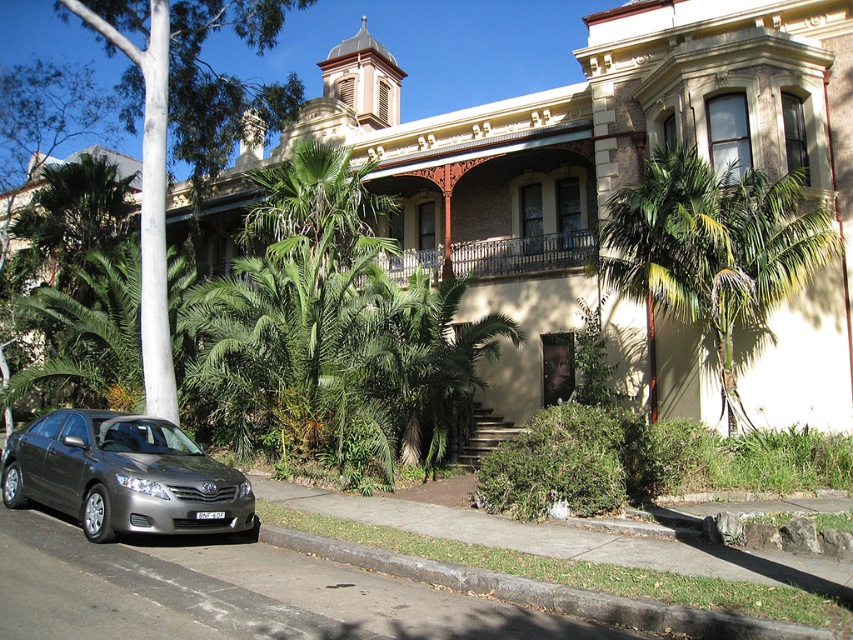
Which of these two, green leafy palm tree at center or gray concrete curb at lower center, stands shorter?

Standing shorter between the two is gray concrete curb at lower center.

Is green leafy palm tree at center below gray concrete curb at lower center?

A: No.

At what (x,y) coordinates should I click in order to perform the action: click on green leafy palm tree at center. Please return your answer as a coordinate pair (x, y). The image size is (853, 640). Looking at the image, I should click on (712, 257).

From the picture: Who is more forward, (202, 531) or (746, 628)?

Point (746, 628) is more forward.

Is satin silver sedan at lower left to the right of gray concrete curb at lower center from the viewer's perspective?

No, satin silver sedan at lower left is not to the right of gray concrete curb at lower center.

You are a GUI agent. You are given a task and a screenshot of the screen. Output one action in this format:
    pyautogui.click(x=<x>, y=<y>)
    Task: Click on the satin silver sedan at lower left
    Image resolution: width=853 pixels, height=640 pixels.
    Given the screenshot: What is the action you would take?
    pyautogui.click(x=125, y=476)

Locate an element on the screen. The image size is (853, 640). satin silver sedan at lower left is located at coordinates (125, 476).

Does green leafy tree at center have a greater width compared to satin silver sedan at lower left?

Correct, the width of green leafy tree at center exceeds that of satin silver sedan at lower left.

What do you see at coordinates (183, 124) in the screenshot?
I see `green leafy tree at center` at bounding box center [183, 124].

What are the coordinates of `green leafy tree at center` in the screenshot? It's located at (183, 124).